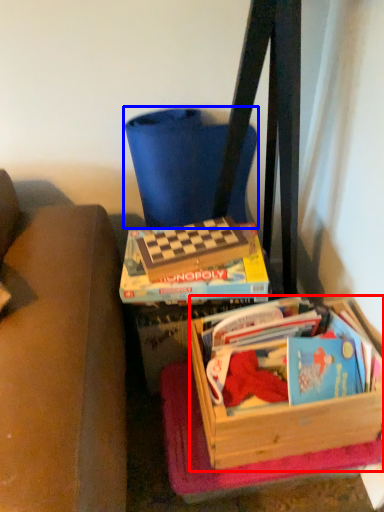
Question: Among these objects, which one is farthest to the camera, box (highlighted by a red box) or folding chair (highlighted by a blue box)?

Choices:
 (A) box
 (B) folding chair

Answer: (B)